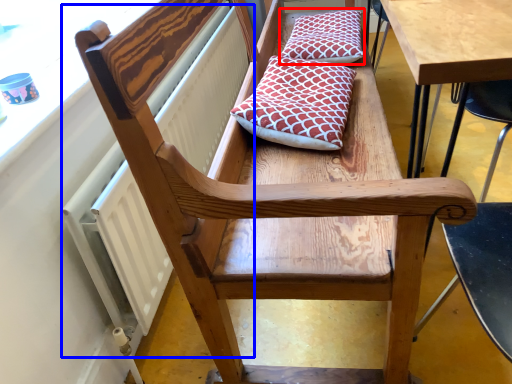
Question: Which of the following is the closest to the observer, pillow (highlighted by a red box) or radiator (highlighted by a blue box)?

Choices:
 (A) pillow
 (B) radiator

Answer: (B)